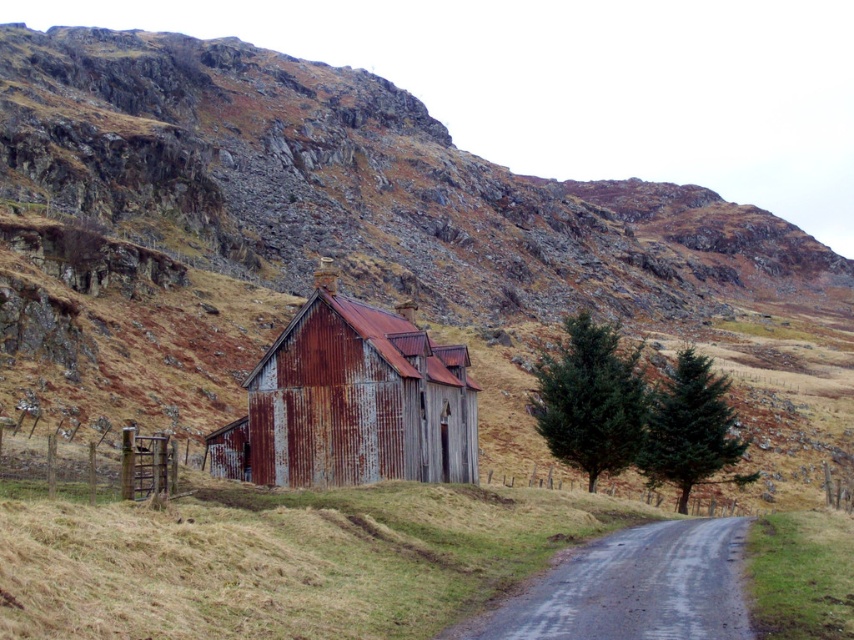
Does rusty corrugated metal barn at center come behind green matte tree at right?

No, rusty corrugated metal barn at center is in front of green matte tree at right.

Does rusty corrugated metal barn at center appear under green matte tree at right?

Indeed, rusty corrugated metal barn at center is positioned under green matte tree at right.

The width and height of the screenshot is (854, 640). I want to click on rusty corrugated metal barn at center, so click(352, 401).

Does green matte tree at right have a lesser width compared to green textured tree at right?

In fact, green matte tree at right might be wider than green textured tree at right.

Does green matte tree at right appear over green textured tree at right?

Indeed, green matte tree at right is positioned over green textured tree at right.

Identify the location of green matte tree at right. (591, 401).

The width and height of the screenshot is (854, 640). What are the coordinates of `rusty corrugated metal barn at center` in the screenshot? It's located at (352, 401).

Does point (437, 355) come closer to viewer compared to point (706, 388)?

Yes, point (437, 355) is in front of point (706, 388).

This screenshot has width=854, height=640. Identify the location of rusty corrugated metal barn at center. (352, 401).